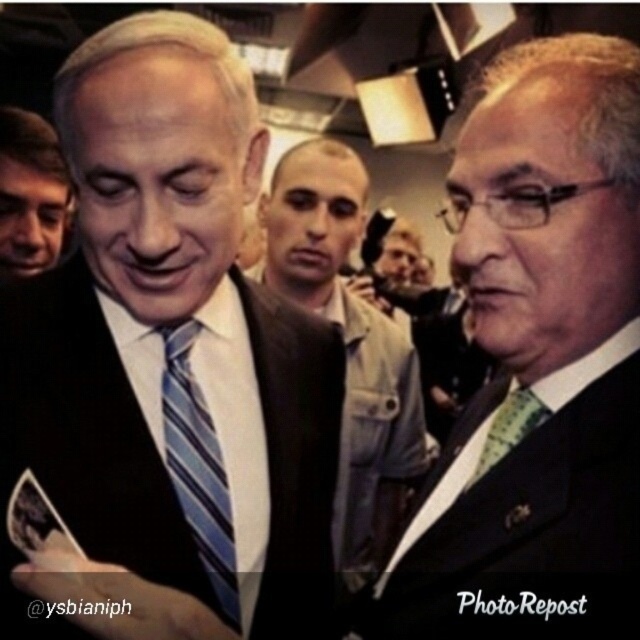
You are organizing a photo shoot and need to ensure that the brown leather jacket at center and the green textured tie at right are visible in the frame. Based on their sizes, which object would require more vertical space to fully capture in the photo?

The brown leather jacket at center is taller than the green textured tie at right, so it would require more vertical space to fully capture in the photo.

You are at a formal event and notice two men in the foreground. One is wearing a matte black suit at left, and the other has a blue striped tie at center. From the perspective of someone standing behind them, which object is positioned to the right?

The blue striped tie at center is to the right of the matte black suit at left.

You are a photographer at a formal event. You need to capture a photo of the blue striped tie at center and the matte black suit at left. Which object is positioned lower in the frame?

The blue striped tie at center is located below the matte black suit at left, so it is positioned lower in the frame.